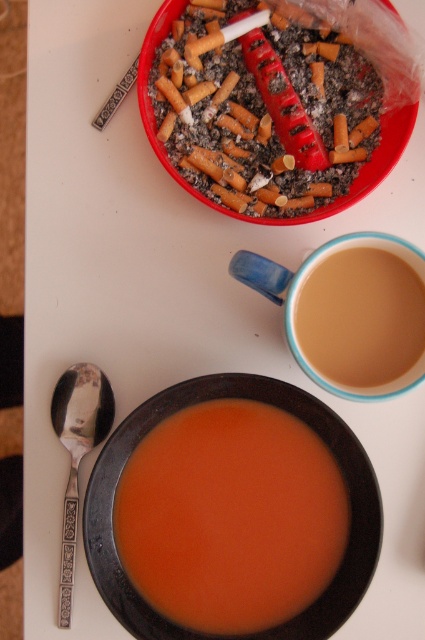
Question: Which object is farther from the camera taking this photo?

Choices:
 (A) orange matte soup at center
 (B) red plastic ashtray at upper center
 (C) brown matte cup at center

Answer: (B)

Question: Which point is closer to the camera?

Choices:
 (A) (73, 449)
 (B) (155, 480)
 (C) (337, 170)
 (D) (325, 340)

Answer: (B)

Question: Is the position of red plastic ashtray at upper center more distant than that of brown matte cup at center?

Choices:
 (A) yes
 (B) no

Answer: (A)

Question: Is brown matte cup at center positioned behind silver metallic spoon at lower left?

Choices:
 (A) yes
 (B) no

Answer: (B)

Question: Which point is closer to the camera?

Choices:
 (A) silver metallic spoon at lower left
 (B) orange matte soup at center
 (C) red plastic ashtray at upper center
 (D) brown matte cup at center

Answer: (D)

Question: Does red plastic ashtray at upper center lie in front of silver metallic spoon at lower left?

Choices:
 (A) no
 (B) yes

Answer: (A)